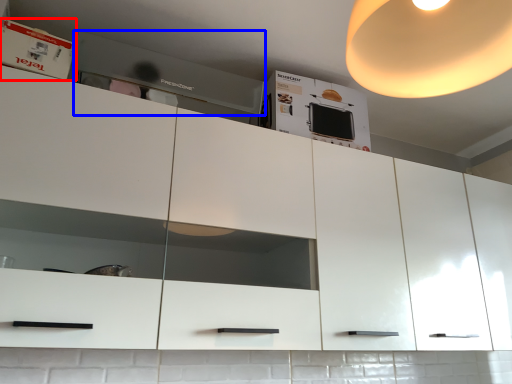
Question: Among these objects, which one is nearest to the camera, cabinet (highlighted by a red box) or home appliance (highlighted by a blue box)?

Choices:
 (A) cabinet
 (B) home appliance

Answer: (A)